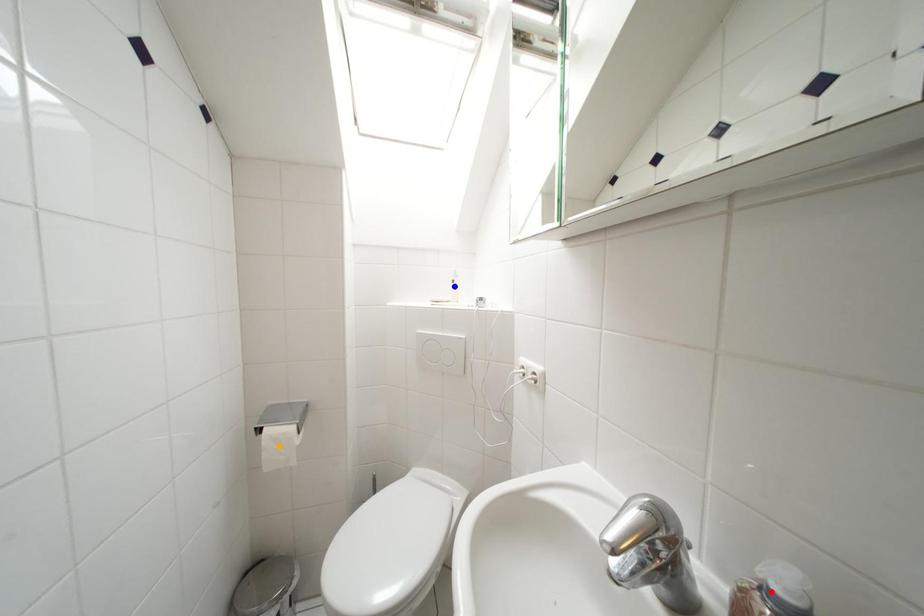
Order these from farthest to nearest:
A) blue point
B) red point
C) orange point

blue point
orange point
red point